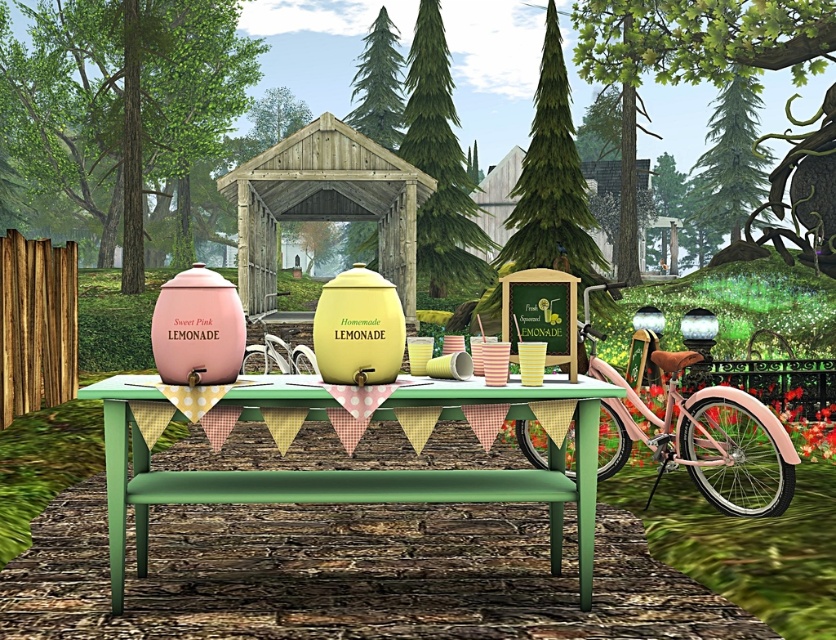
You are setting up a lemonade stand and need to place a 3ft wide banner between the green wooden table at center and the pink matte bicycle at right. Will the banner fit between them if the space between them is 4ft?

The green wooden table at center is wider than the pink matte bicycle at right. However, the space between them is 4ft, which is wider than the banner requiring 3ft. Therefore, the banner can fit between them as long as the positioning allows for the width needed.

You are standing at the entrance of the lemonade stand area. Where exactly is the green wooden table at center located in terms of coordinates?

The green wooden table at center is located at coordinates point (358, 470).

You are a customer walking towards the lemonade stand. Which object will you encounter first, the green wooden table at center or the pink matte bicycle at right?

The green wooden table at center is in front of the pink matte bicycle at right, so you will encounter the green wooden table at center first as you approach the lemonade stand.